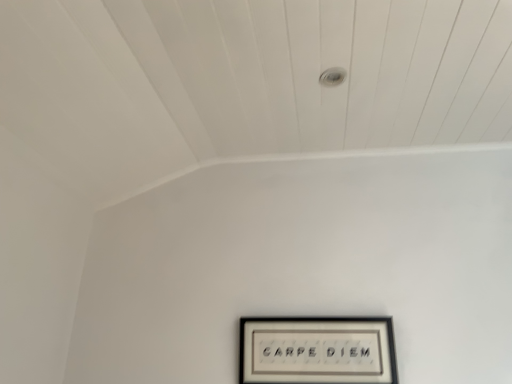
What do you see at coordinates (317, 350) in the screenshot? The image size is (512, 384). I see `black matte picture frame at lower center` at bounding box center [317, 350].

In order to face black matte picture frame at lower center, should I rotate leftwards or rightwards?

Rotate your view right by about 7.912°.

You are a GUI agent. You are given a task and a screenshot of the screen. Output one action in this format:
    pyautogui.click(x=<x>, y=<y>)
    Task: Click on the black matte picture frame at lower center
    The image size is (512, 384).
    Given the screenshot: What is the action you would take?
    pyautogui.click(x=317, y=350)

Looking at this image, what is the approximate height of black matte picture frame at lower center?

It is 9.02 inches.

Measure the distance between black matte picture frame at lower center and camera.

The depth of black matte picture frame at lower center is 1.44 meters.

Where is `black matte picture frame at lower center`? This screenshot has height=384, width=512. black matte picture frame at lower center is located at coordinates (317, 350).